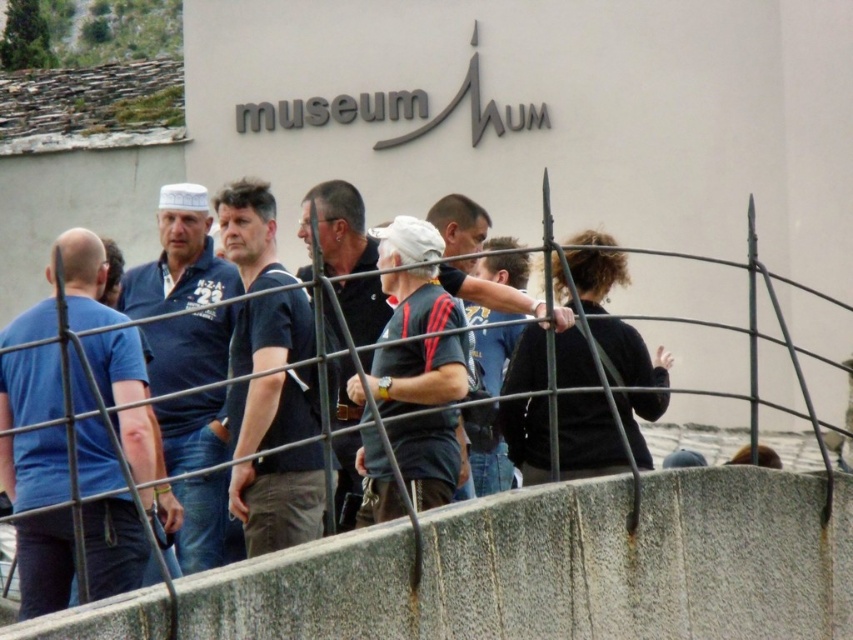
Question: Does dark blue shirt at center lie behind dark gray fabric shirt at center?

Choices:
 (A) yes
 (B) no

Answer: (B)

Question: Which is nearer to the dark gray fabric shirt at center?

Choices:
 (A) matte black shirt at center
 (B) gray concrete barrier at lower center
 (C) dark blue shirt at center
 (D) dark blue polo shirt at center

Answer: (A)

Question: Is gray concrete barrier at lower center in front of matte black shirt at center?

Choices:
 (A) no
 (B) yes

Answer: (B)

Question: Is matte black shirt at center wider than dark gray fabric shirt at center?

Choices:
 (A) no
 (B) yes

Answer: (A)

Question: Which point is closer to the camera?

Choices:
 (A) (512, 365)
 (B) (521, 291)
 (C) (759, 582)

Answer: (C)

Question: Which point is farther to the camera?

Choices:
 (A) (128, 340)
 (B) (575, 584)
 (C) (511, 392)

Answer: (C)